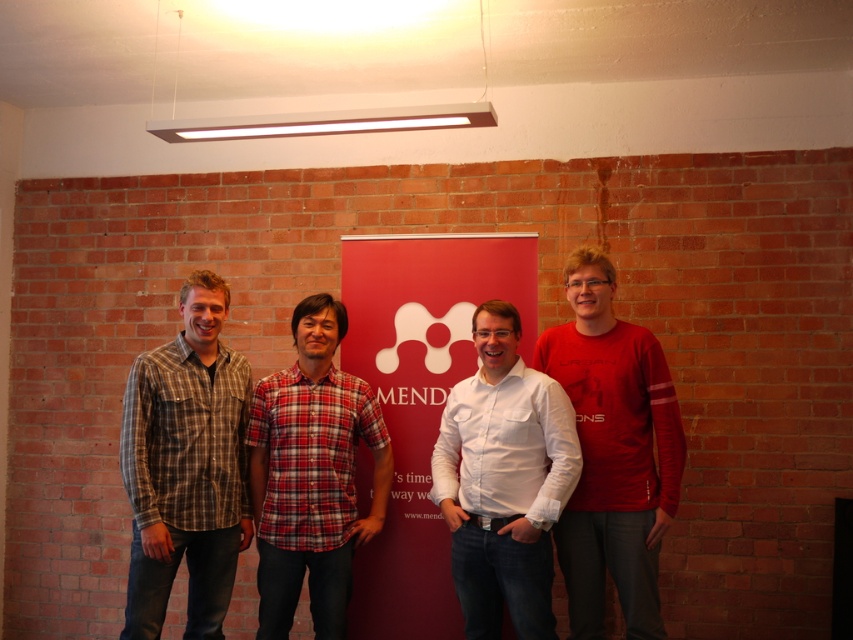
Does red matte banner at center appear under matte red shirt at right?

Incorrect, red matte banner at center is not positioned below matte red shirt at right.

Is red matte banner at center taller than matte red shirt at right?

Yes.

Locate an element on the screen. red matte banner at center is located at coordinates (421, 401).

Find the location of a particular element. The height and width of the screenshot is (640, 853). red matte banner at center is located at coordinates (421, 401).

Can you confirm if matte red shirt at right is wider than red plaid shirt at center?

No.

Is point (664, 442) less distant than point (317, 625)?

Yes.

What are the coordinates of `matte red shirt at right` in the screenshot? It's located at (612, 452).

Which is more to the left, plaid flannel shirt at left or white cotton shirt at center?

From the viewer's perspective, plaid flannel shirt at left appears more on the left side.

Between plaid flannel shirt at left and white cotton shirt at center, which one has less height?

With less height is white cotton shirt at center.

Find the location of a particular element. This screenshot has height=640, width=853. plaid flannel shirt at left is located at coordinates (186, 467).